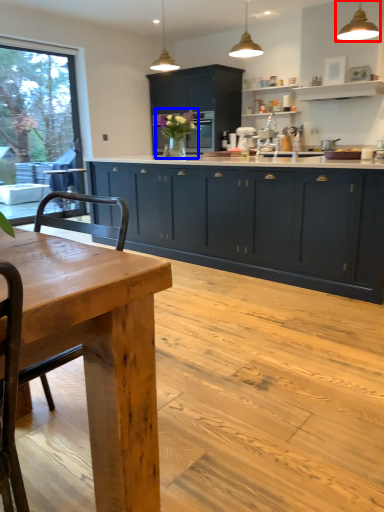
Question: Which of the following is the closest to the observer, light fixture (highlighted by a red box) or floral arrangement (highlighted by a blue box)?

Choices:
 (A) light fixture
 (B) floral arrangement

Answer: (A)